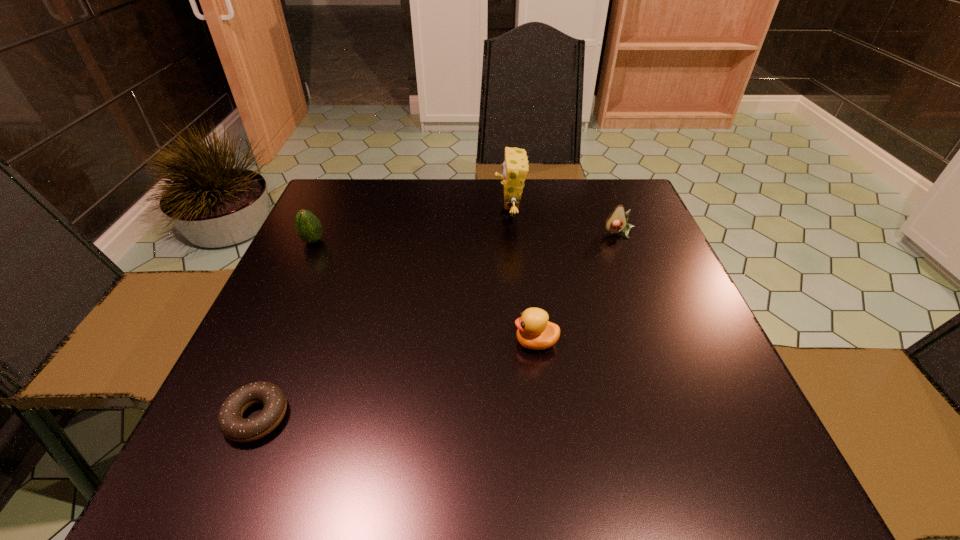
Image resolution: width=960 pixels, height=540 pixels. In order to click on vacant area between the duckling and the rightmost object in this screenshot , I will do `click(577, 288)`.

Identify the location of free point between the tallest object and the nearest object. The image size is (960, 540). (383, 316).

Where is `vacant space in between the tallest object and the doughnut`? vacant space in between the tallest object and the doughnut is located at coordinates (383, 316).

Where is `vacant area that lies between the left avocado and the duckling`? vacant area that lies between the left avocado and the duckling is located at coordinates (424, 292).

At what (x,y) coordinates should I click in order to perform the action: click on vacant space in between the duckling and the shortest object. Please return your answer as a coordinate pair (x, y). Looking at the image, I should click on (396, 380).

Where is `vacant space in between the duckling and the sponge`? Image resolution: width=960 pixels, height=540 pixels. vacant space in between the duckling and the sponge is located at coordinates (522, 279).

The height and width of the screenshot is (540, 960). What are the coordinates of `free space that is in between the nearest object and the second nearest object` in the screenshot? It's located at (396, 380).

Where is `empty space between the rightmost object and the shortest object`? empty space between the rightmost object and the shortest object is located at coordinates (438, 325).

At what (x,y) coordinates should I click in order to perform the action: click on object that is the fourth nearest to the rightmost object. Please return your answer as a coordinate pair (x, y). The height and width of the screenshot is (540, 960). Looking at the image, I should click on (232, 425).

Locate which object ranks second in proximity to the rightmost object. Please provide its 2D coordinates. Your answer should be formatted as a tuple, i.e. [(x, y)], where the tuple contains the x and y coordinates of a point satisfying the conditions above.

[(534, 331)]